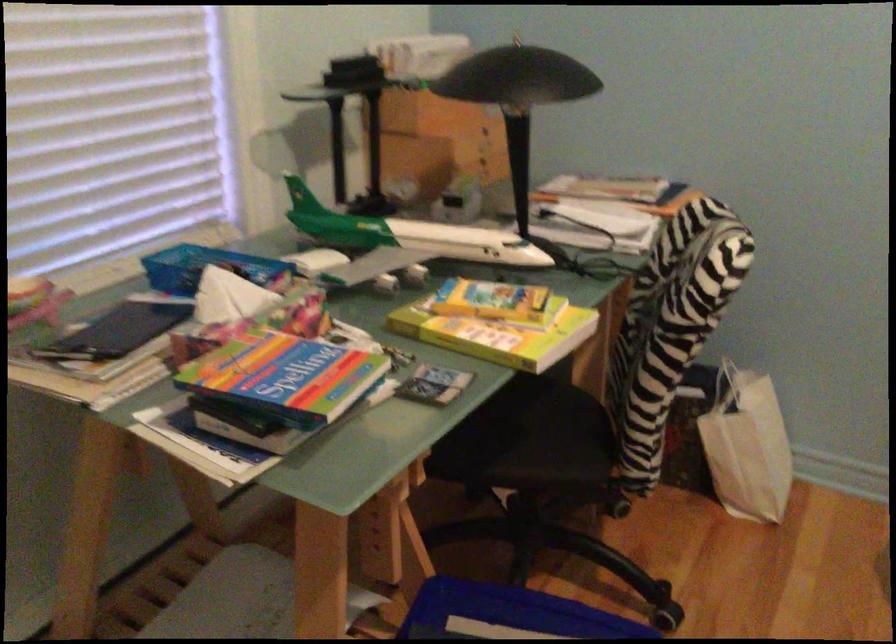
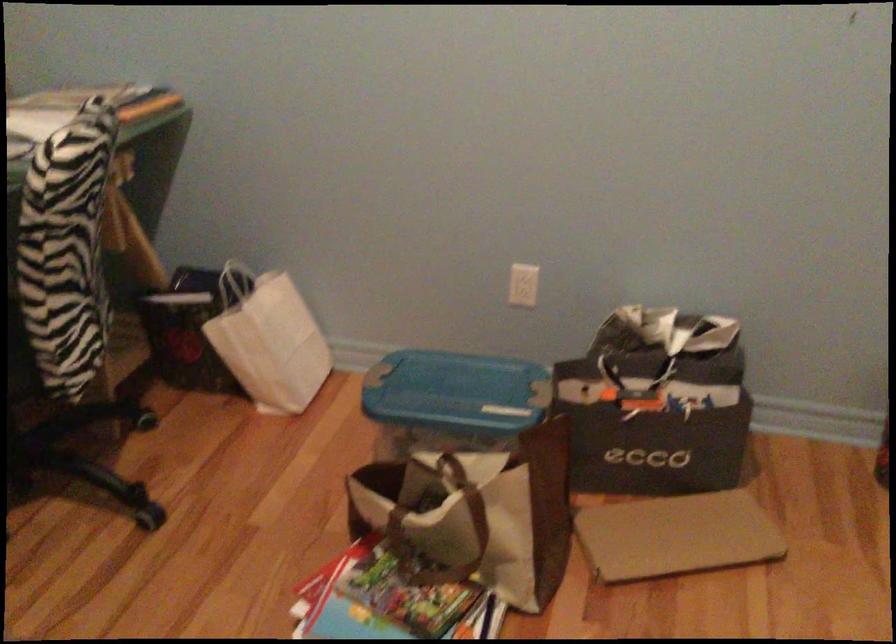
Question: What movement of the cameraman would produce the second image?

Choices:
 (A) Left
 (B) Right
 (C) Forward
 (D) Backward

Answer: (B)